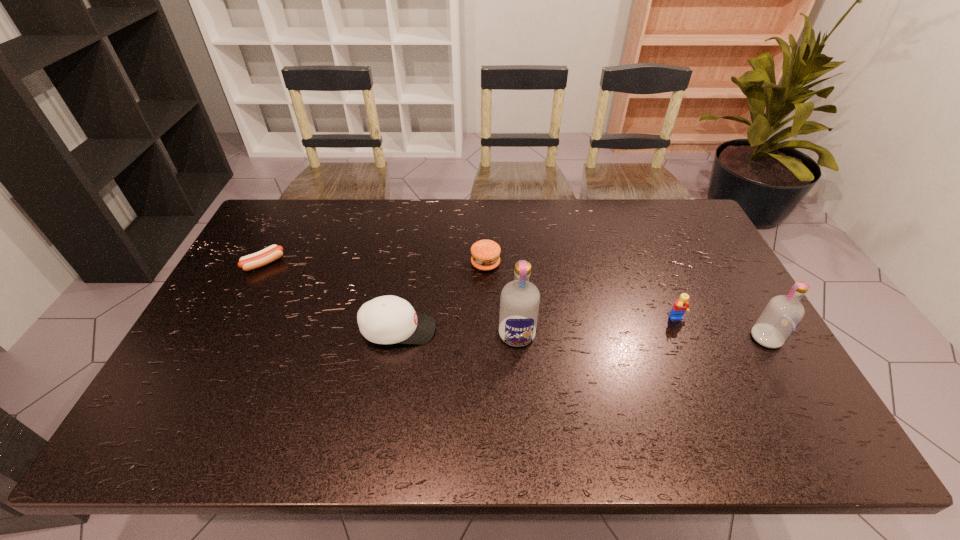
This screenshot has width=960, height=540. Identify the location of vacant position in the image that satisfies the following two spatial constraints: 1. on the front side of the second shortest object; 2. on the front-facing side of the baseball cap. (487, 330).